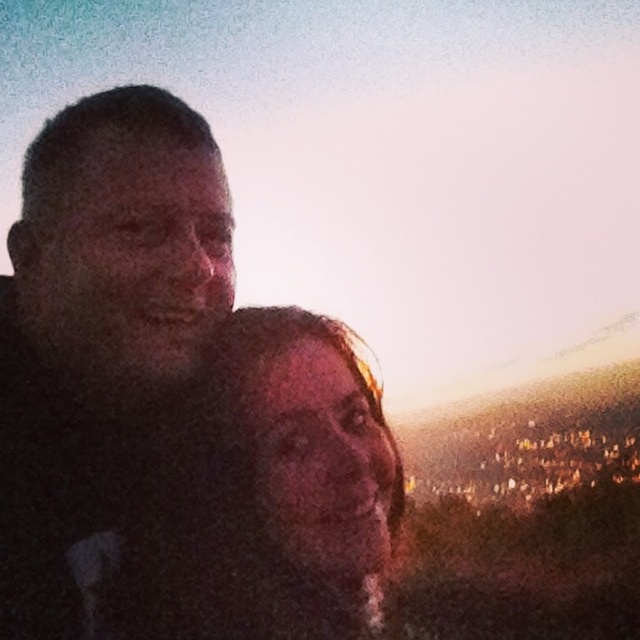
Question: Which point appears closest to the camera in this image?

Choices:
 (A) (300, 515)
 (B) (109, 428)

Answer: (A)

Question: Is dark matte face at left to the right of matte skin tone face at center from the viewer's perspective?

Choices:
 (A) no
 (B) yes

Answer: (A)

Question: Which object is closer to the camera taking this photo?

Choices:
 (A) matte skin tone face at center
 (B) dark matte face at left

Answer: (A)

Question: Can you confirm if dark matte face at left is positioned below matte skin tone face at center?

Choices:
 (A) no
 (B) yes

Answer: (A)

Question: Is dark matte face at left positioned at the back of matte skin tone face at center?

Choices:
 (A) no
 (B) yes

Answer: (B)